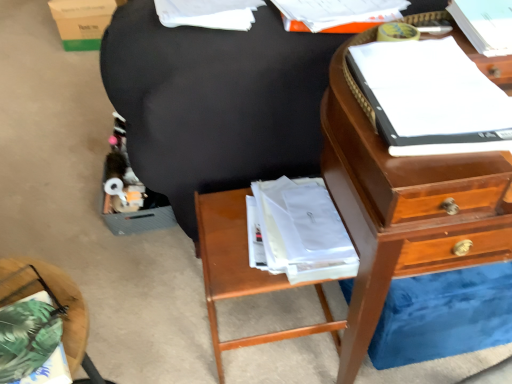
Question: Is white paper at upper center, the third book in the right-to-left sequence, outside of green fabric pillow at lower left, the second nightstand in the right-to-left sequence?

Choices:
 (A) yes
 (B) no

Answer: (A)

Question: Does white paper at upper center, marked as the first book in a left-to-right arrangement, lie behind green fabric pillow at lower left, the first nightstand from the front?

Choices:
 (A) no
 (B) yes

Answer: (B)

Question: Are white paper at upper center, marked as the first book in a left-to-right arrangement, and green fabric pillow at lower left, the first nightstand when ordered from left to right, far apart?

Choices:
 (A) no
 (B) yes

Answer: (A)

Question: Does white paper at upper center, marked as the first book in a left-to-right arrangement, appear on the right side of green fabric pillow at lower left, the first nightstand from the front?

Choices:
 (A) yes
 (B) no

Answer: (A)

Question: Considering the relative positions of white paper at upper center, marked as the first book in a left-to-right arrangement, and green fabric pillow at lower left, the first nightstand from the front, in the image provided, is white paper at upper center, marked as the first book in a left-to-right arrangement, to the left of green fabric pillow at lower left, the first nightstand from the front, from the viewer's perspective?

Choices:
 (A) no
 (B) yes

Answer: (A)

Question: Could you tell me if white paper at upper center, the third book in the right-to-left sequence, is turned towards green fabric pillow at lower left, the first nightstand from the front?

Choices:
 (A) no
 (B) yes

Answer: (A)

Question: Considering the relative positions of green fabric pillow at lower left, the first nightstand from the front, and wooden nightstand at lower center, positioned as the first nightstand in back-to-front order, in the image provided, is green fabric pillow at lower left, the first nightstand from the front, to the right of wooden nightstand at lower center, positioned as the first nightstand in back-to-front order, from the viewer's perspective?

Choices:
 (A) yes
 (B) no

Answer: (B)

Question: Is green fabric pillow at lower left, the first nightstand when ordered from left to right, facing towards wooden nightstand at lower center, the first nightstand viewed from the right?

Choices:
 (A) no
 (B) yes

Answer: (A)

Question: Considering the relative positions of green fabric pillow at lower left, the first nightstand from the front, and wooden nightstand at lower center, which is the second nightstand from front to back, in the image provided, is green fabric pillow at lower left, the first nightstand from the front, in front of wooden nightstand at lower center, which is the second nightstand from front to back,?

Choices:
 (A) yes
 (B) no

Answer: (A)

Question: Is green fabric pillow at lower left, the first nightstand when ordered from left to right, further to camera compared to wooden nightstand at lower center, the first nightstand viewed from the right?

Choices:
 (A) no
 (B) yes

Answer: (A)

Question: From a real-world perspective, is green fabric pillow at lower left, which appears as the 2th nightstand when viewed from the back, positioned under wooden nightstand at lower center, the first nightstand viewed from the right, based on gravity?

Choices:
 (A) no
 (B) yes

Answer: (A)

Question: Is green fabric pillow at lower left, the first nightstand when ordered from left to right, taller than wooden nightstand at lower center, positioned as the first nightstand in back-to-front order?

Choices:
 (A) yes
 (B) no

Answer: (B)

Question: From the image's perspective, is green fabric pillow at lower left, the second nightstand in the right-to-left sequence, located beneath green cardboard box at upper left?

Choices:
 (A) yes
 (B) no

Answer: (A)